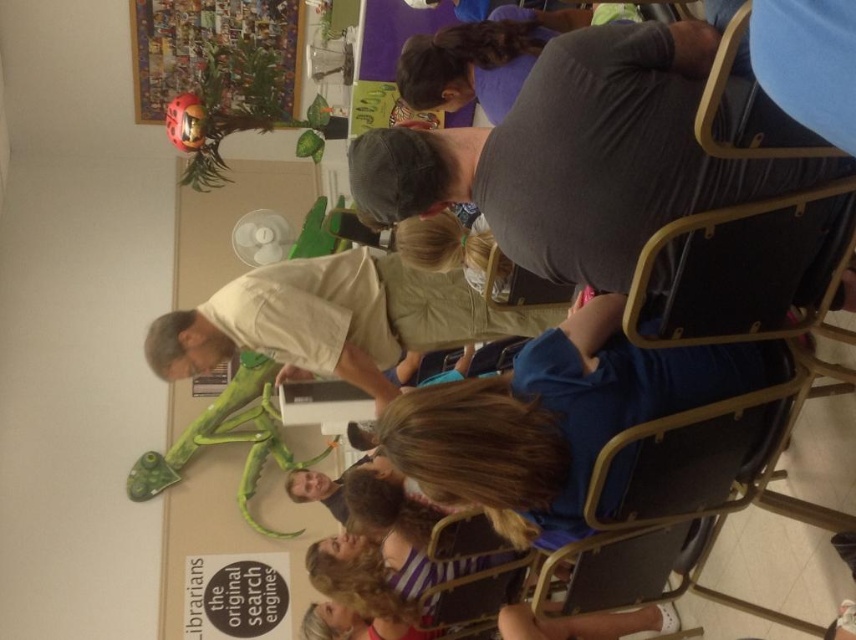
Question: Which object is the closest to the metallic silver puzzle at upper left?

Choices:
 (A) gray cotton shirt at upper center
 (B) light beige shirt at center

Answer: (B)

Question: Which point is farther from the camera taking this photo?

Choices:
 (A) (165, 26)
 (B) (310, 324)

Answer: (A)

Question: Which object is closer to the camera taking this photo?

Choices:
 (A) light beige shirt at center
 (B) gray cotton shirt at upper center
 (C) metallic silver puzzle at upper left

Answer: (B)

Question: Does light beige shirt at center appear on the left side of metallic silver puzzle at upper left?

Choices:
 (A) no
 (B) yes

Answer: (A)

Question: In this image, where is light beige shirt at center located relative to metallic silver puzzle at upper left?

Choices:
 (A) left
 (B) right

Answer: (B)

Question: Can you confirm if gray cotton shirt at upper center is positioned below light beige shirt at center?

Choices:
 (A) yes
 (B) no

Answer: (B)